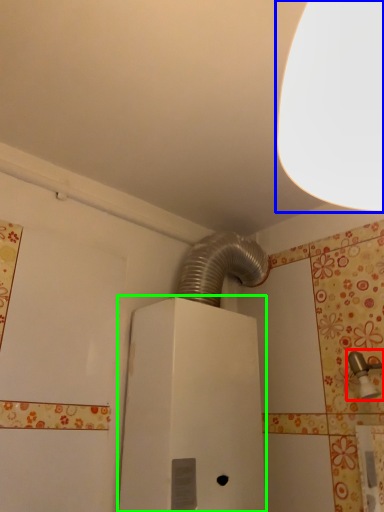
Question: Based on their relative distances, which object is nearer to plumbing fixture (highlighted by a red box)? Choose from lamp (highlighted by a blue box) and water heater (highlighted by a green box).

Choices:
 (A) lamp
 (B) water heater

Answer: (B)